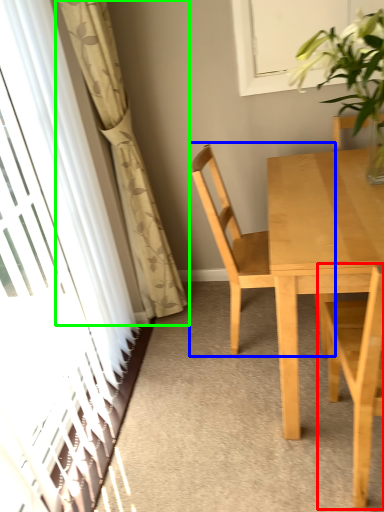
Question: Which object is the closest to the chair (highlighted by a red box)? Choose among these: chair (highlighted by a blue box) or curtain (highlighted by a green box).

Choices:
 (A) chair
 (B) curtain

Answer: (A)